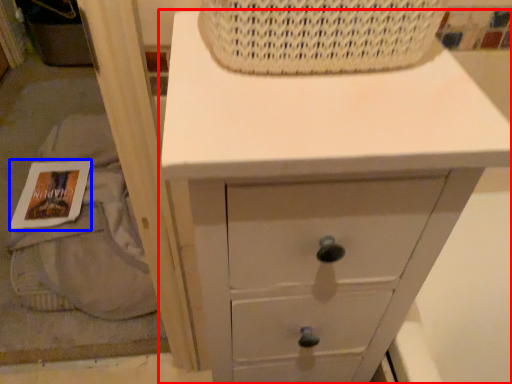
Question: Among these objects, which one is farthest to the camera, chest of drawers (highlighted by a red box) or magazine (highlighted by a blue box)?

Choices:
 (A) chest of drawers
 (B) magazine

Answer: (B)